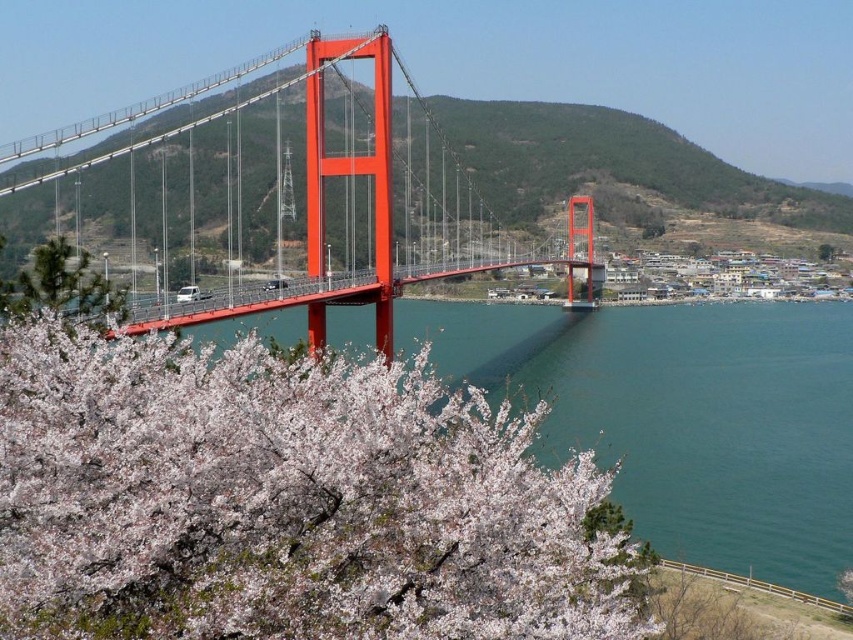
Question: Which object is closer to the camera taking this photo?

Choices:
 (A) clear blue water at lower center
 (B) bright orange bridge at center

Answer: (A)

Question: Can you confirm if clear blue water at lower center is wider than white matte tree at lower left?

Choices:
 (A) no
 (B) yes

Answer: (B)

Question: Which of the following is the farthest from the observer?

Choices:
 (A) bright orange bridge at center
 (B) clear blue water at lower center

Answer: (A)

Question: Which object is farther from the camera taking this photo?

Choices:
 (A) clear blue water at lower center
 (B) white matte tree at lower left

Answer: (B)

Question: Where is clear blue water at lower center located in relation to white matte tree at lower left in the image?

Choices:
 (A) above
 (B) below

Answer: (B)

Question: Is the position of bright orange bridge at center more distant than that of white matte tree at lower left?

Choices:
 (A) yes
 (B) no

Answer: (A)